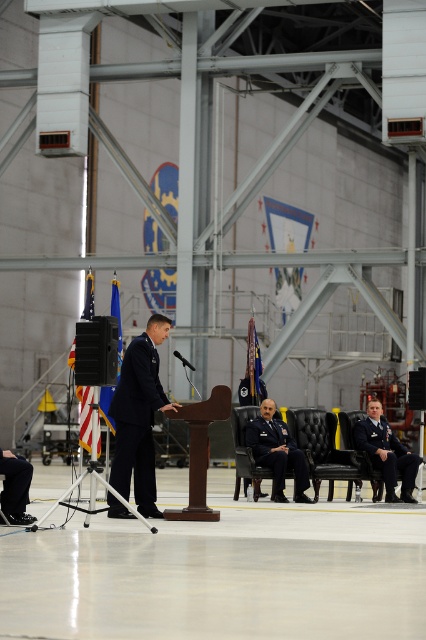
Question: Estimate the real-world distances between objects in this image. Which object is closer to the black matte uniform at lower right?

Choices:
 (A) black fabric pants at lower left
 (B) dark blue fabric uniform at center
 (C) navy blue fabric uniform at center

Answer: (B)

Question: Considering the relative positions of dark blue fabric uniform at center and black matte uniform at lower right in the image provided, where is dark blue fabric uniform at center located with respect to black matte uniform at lower right?

Choices:
 (A) below
 (B) above

Answer: (B)

Question: Is black matte uniform at lower right smaller than black fabric pants at lower left?

Choices:
 (A) no
 (B) yes

Answer: (A)

Question: Estimate the real-world distances between objects in this image. Which object is farther from the dark blue fabric uniform at center?

Choices:
 (A) black matte uniform at lower right
 (B) navy blue fabric uniform at center

Answer: (B)

Question: Considering the relative positions of dark blue fabric uniform at center and black matte uniform at lower right in the image provided, where is dark blue fabric uniform at center located with respect to black matte uniform at lower right?

Choices:
 (A) below
 (B) above

Answer: (B)

Question: Which object appears farthest from the camera in this image?

Choices:
 (A) dark blue fabric uniform at center
 (B) black fabric pants at lower left
 (C) navy blue fabric uniform at center
 (D) black matte uniform at lower right

Answer: (D)